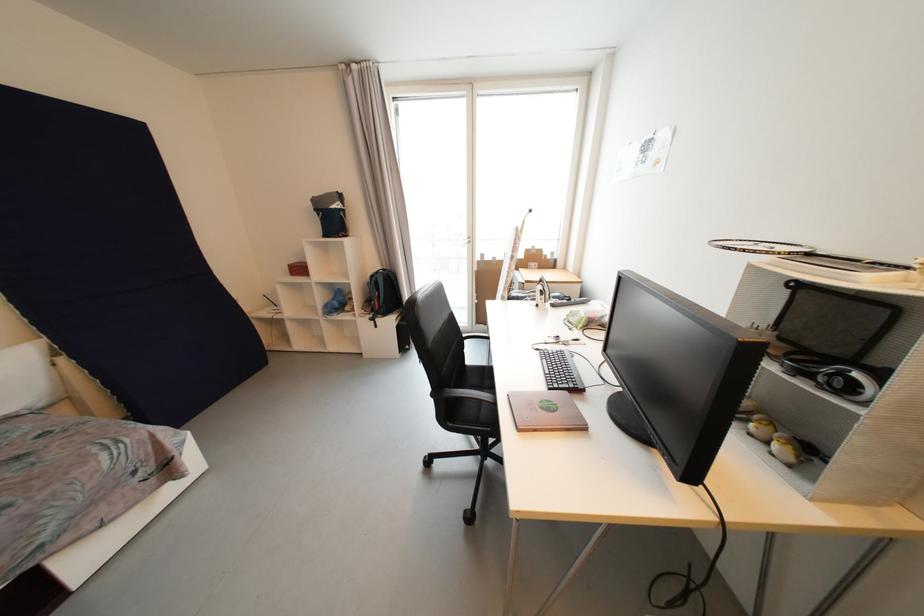
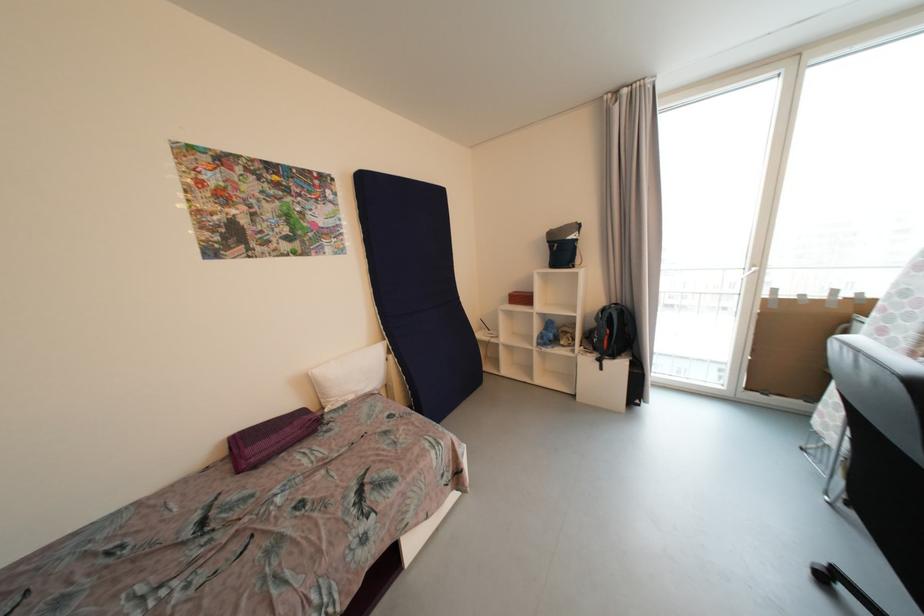
Locate, in the second image, the point that corresponds to the point at 378,278 in the first image.

(608, 312)